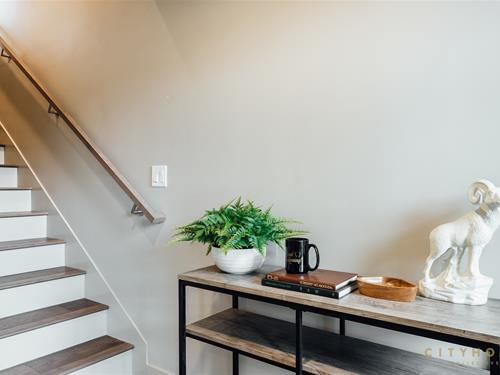
Locate an element on the screen. The image size is (500, 375). wall is located at coordinates (295, 68).